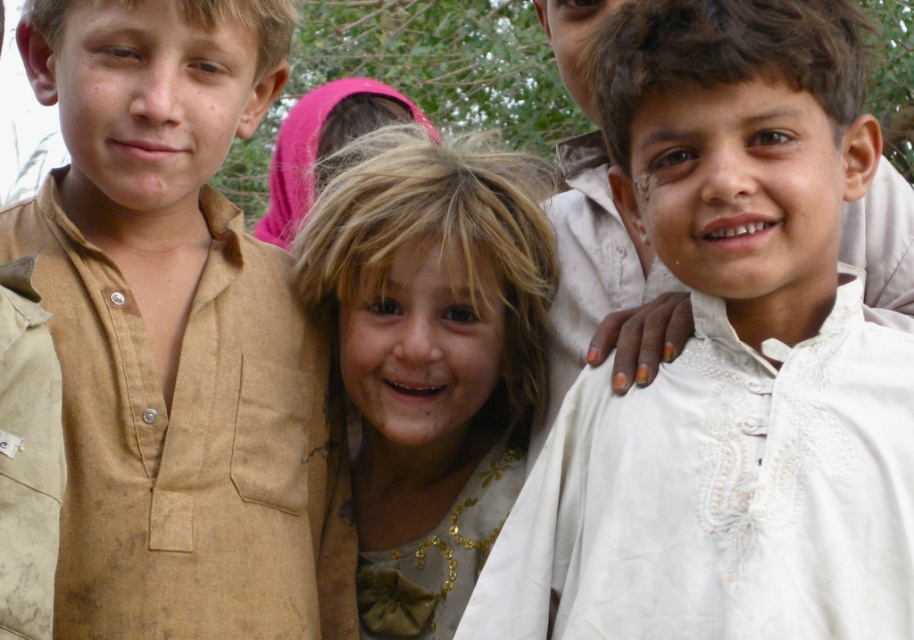
Question: Can you confirm if white embroidered shirt at center is smaller than golden sequined dress at center?

Choices:
 (A) yes
 (B) no

Answer: (B)

Question: Which of the following is the farthest from the observer?

Choices:
 (A) white embroidered shirt at center
 (B) golden sequined dress at center
 (C) brown cotton shirt at left

Answer: (B)

Question: Is white embroidered shirt at center thinner than brown cotton shirt at left?

Choices:
 (A) no
 (B) yes

Answer: (A)

Question: Is white embroidered shirt at center above brown cotton shirt at left?

Choices:
 (A) no
 (B) yes

Answer: (A)

Question: Which point is closer to the camera taking this photo?

Choices:
 (A) (391, 333)
 (B) (60, 333)

Answer: (B)

Question: Based on their relative distances, which object is farther from the white embroidered shirt at center?

Choices:
 (A) golden sequined dress at center
 (B) brown cotton shirt at left

Answer: (A)